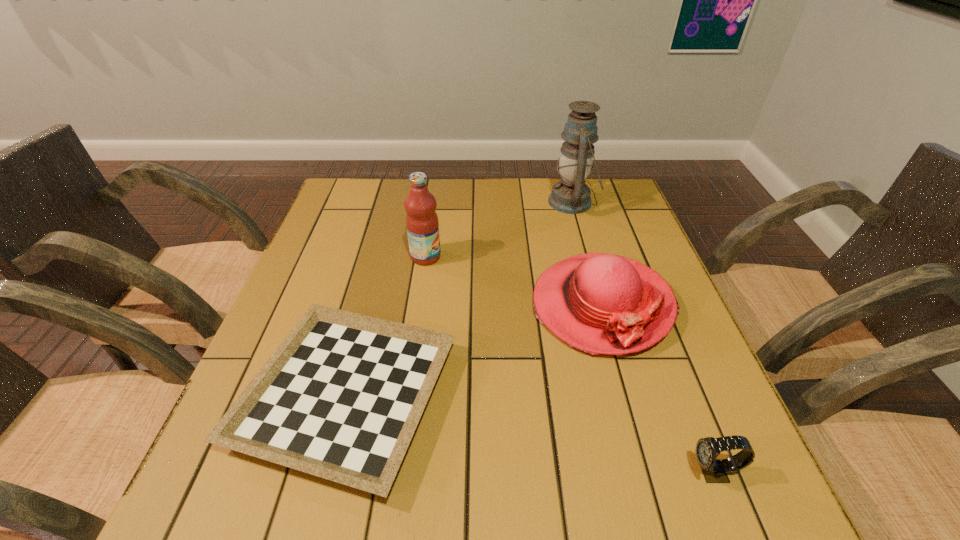
The height and width of the screenshot is (540, 960). What are the coordinates of `free space located on the face of the second shortest object` in the screenshot? It's located at (457, 472).

Find the location of a particular element. The width and height of the screenshot is (960, 540). free spot located 0.210m on the face of the second shortest object is located at coordinates (561, 472).

Where is `vacant area situated 0.230m on the right of the checkerboard`? Image resolution: width=960 pixels, height=540 pixels. vacant area situated 0.230m on the right of the checkerboard is located at coordinates (577, 396).

Locate an element on the screen. The width and height of the screenshot is (960, 540). object that is at the far edge is located at coordinates (571, 195).

Find the location of a particular element. This screenshot has width=960, height=540. watch that is at the near edge is located at coordinates (714, 470).

Locate an element on the screen. The image size is (960, 540). checkerboard that is at the near edge is located at coordinates (340, 398).

Locate an element on the screen. Image resolution: width=960 pixels, height=540 pixels. object that is at the left edge is located at coordinates (340, 398).

Where is `oil lamp that is at the right edge`? This screenshot has width=960, height=540. oil lamp that is at the right edge is located at coordinates (571, 195).

The height and width of the screenshot is (540, 960). What are the coordinates of `hat located at the right edge` in the screenshot? It's located at (599, 303).

Locate an element on the screen. The image size is (960, 540). watch located at the right edge is located at coordinates (714, 470).